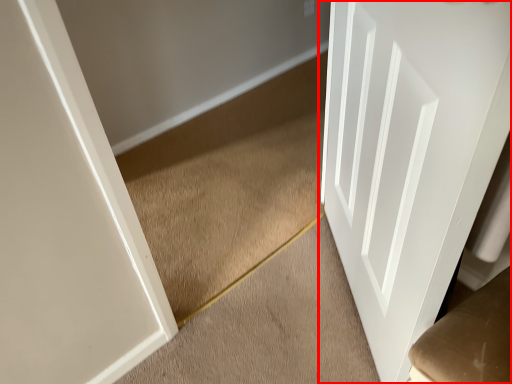
Question: From the image's perspective, what is the correct spatial relationship of door (annotated by the red box) in relation to stairwell?

Choices:
 (A) below
 (B) above

Answer: (B)